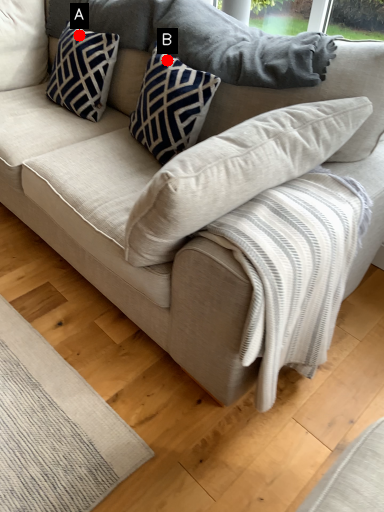
Question: Two points are circled on the image, labeled by A and B beside each circle. Which point is farther from the camera taking this photo?

Choices:
 (A) A is further
 (B) B is further

Answer: (A)